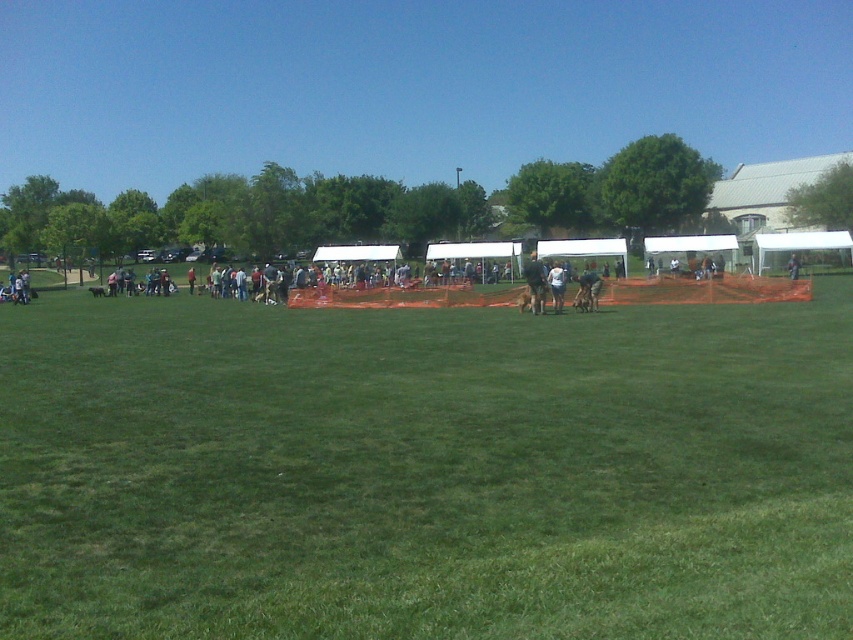
Question: Can you confirm if green grassy field at center is positioned to the left of matte black dog at center?

Choices:
 (A) no
 (B) yes

Answer: (B)

Question: Which of the following is the farthest from the observer?

Choices:
 (A) green grassy field at center
 (B) matte black dog at center
 (C) white cotton shirt at center

Answer: (B)

Question: In this image, where is white cotton shirt at center located relative to matte black dog at center?

Choices:
 (A) left
 (B) right

Answer: (A)

Question: Which object is the farthest from the matte black dog at center?

Choices:
 (A) green grassy field at center
 (B) white cotton shirt at center

Answer: (A)

Question: Does white cotton shirt at center appear under matte black dog at center?

Choices:
 (A) no
 (B) yes

Answer: (B)

Question: Which of the following is the farthest from the observer?

Choices:
 (A) (561, 268)
 (B) (792, 268)

Answer: (B)